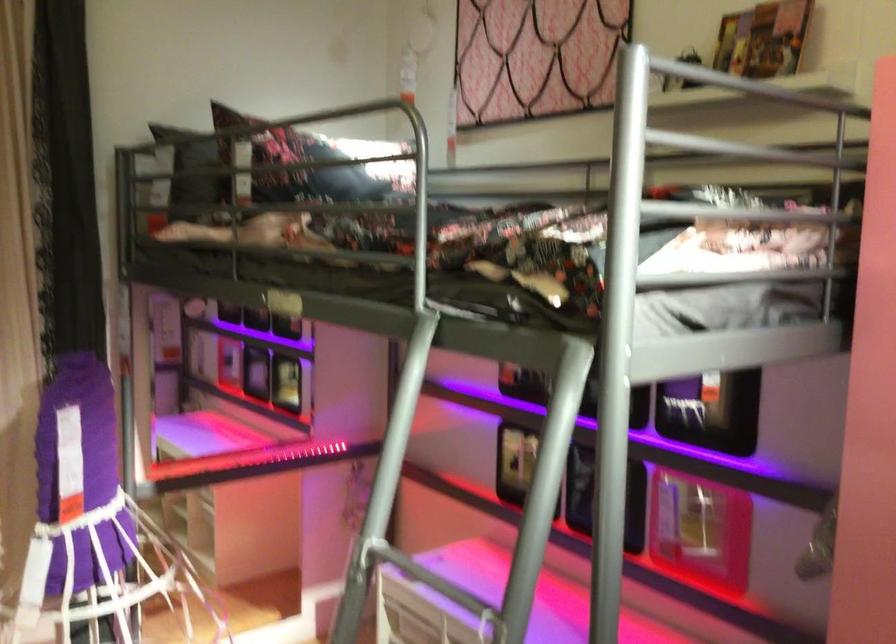
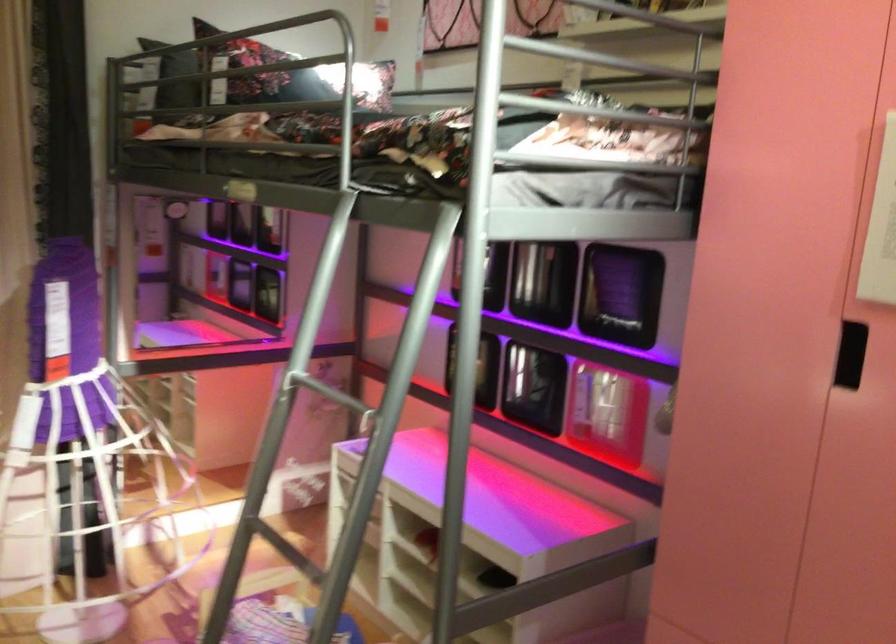
Find the pixel in the second image that matches point (415, 571) in the first image.

(323, 391)